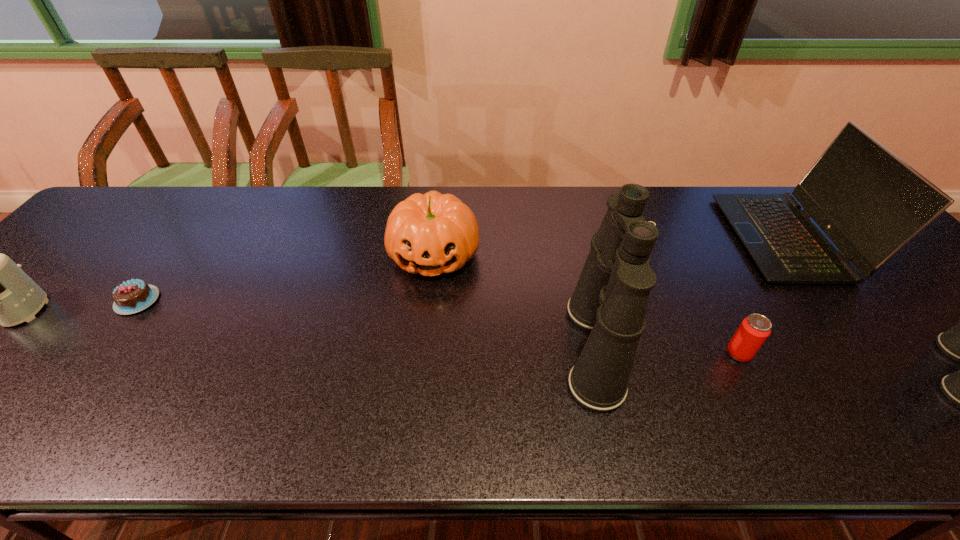
Observe the arrangement of all binocularss in the image. To keep them evenly spaced, where would you place another binoculars on the left? Please locate a free space. Please provide its 2D coordinates. Your answer should be formatted as a tuple, i.e. [(x, y)], where the tuple contains the x and y coordinates of a point satisfying the conditions above.

[(258, 327)]